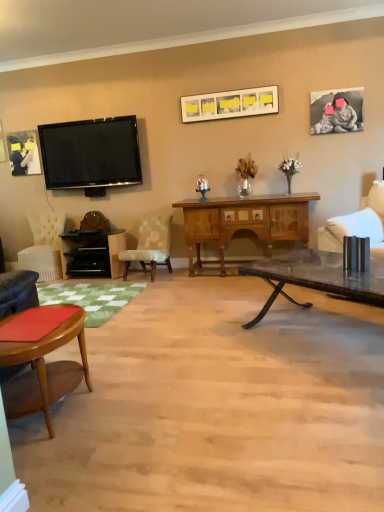
Where is `free area below transparent glass coffee table at center (from a real-world perspective)`? The image size is (384, 512). free area below transparent glass coffee table at center (from a real-world perspective) is located at coordinates (328, 335).